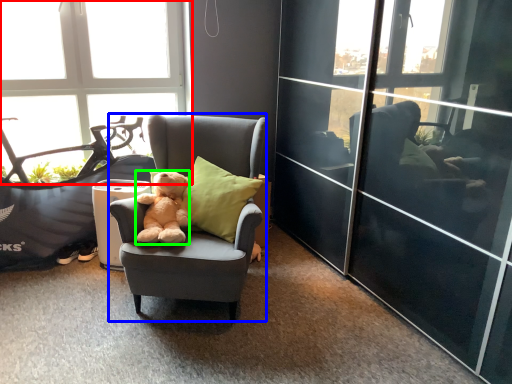
Question: Estimate the real-world distances between objects in this image. Which object is closer to window (highlighted by a red box), chair (highlighted by a blue box) or teddy bear (highlighted by a green box)?

Choices:
 (A) chair
 (B) teddy bear

Answer: (B)